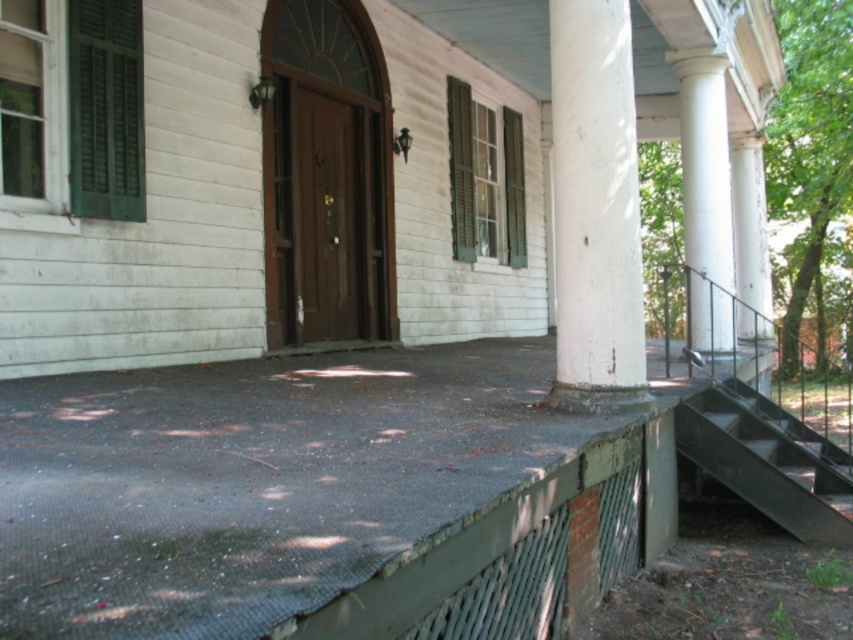
You are a painter standing on the porch and need to paint both the white painted wood column at right and the green wood shutter at center. If you can only carry enough paint to cover 20 feet of distance between objects, will you have enough paint to move from one to the other without returning to your supply?

The white painted wood column at right is 18.57 feet away from the green wood shutter at center. Since 18.57 feet is less than 20 feet, you have enough paint to move between them without needing to return to your supply.

You are a delivery person approaching the house and need to deliver a package. The instructions say to place it at the base of the green wood shutter at center. However, you notice the brown wooden door at center. Where should you place the package?

The brown wooden door at center is located below the green wood shutter at center, so you should place the package at the base of the green wood shutter at center, which is above the brown wooden door at center.

You are standing on the front porch of the house and want to go down to the garden. You see the metallic gray stairs at lower right and the green wood shutter at center. Which object should you use to exit the porch?

You should use the metallic gray stairs at lower right to exit the porch because it is located below the green wood shutter at center, making it the correct path downward.